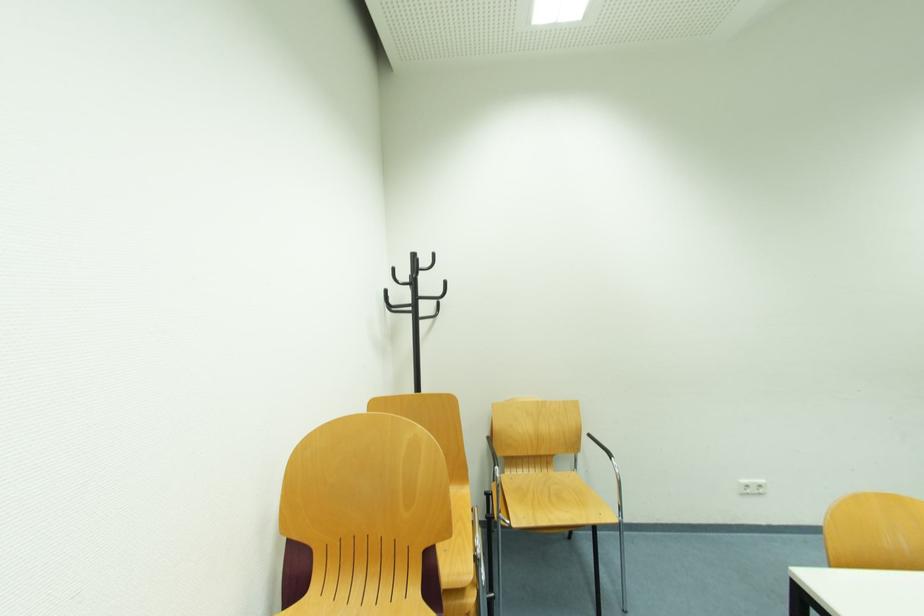
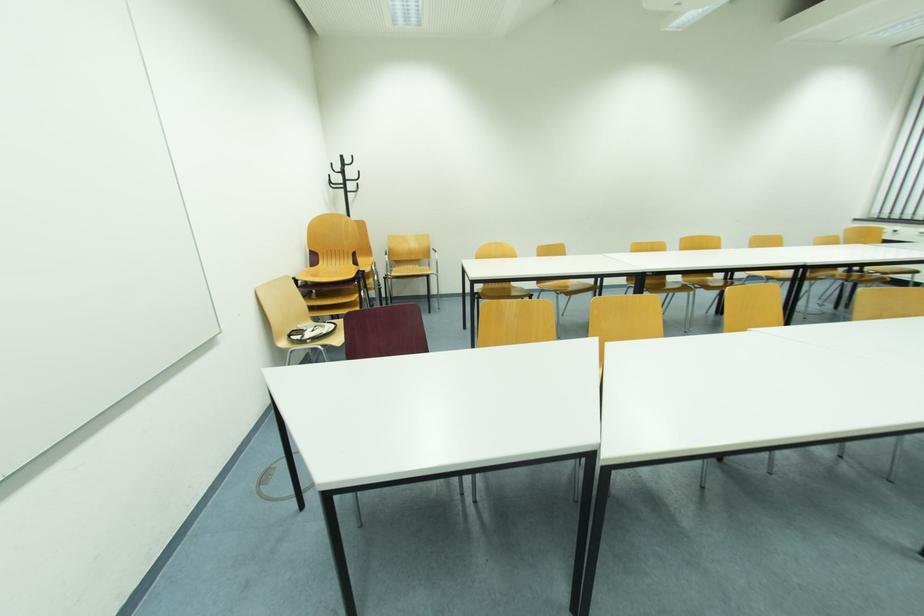
Question: What movement of the cameraman would produce the second image?

Choices:
 (A) Left
 (B) Right
 (C) Forward
 (D) Backward

Answer: (D)